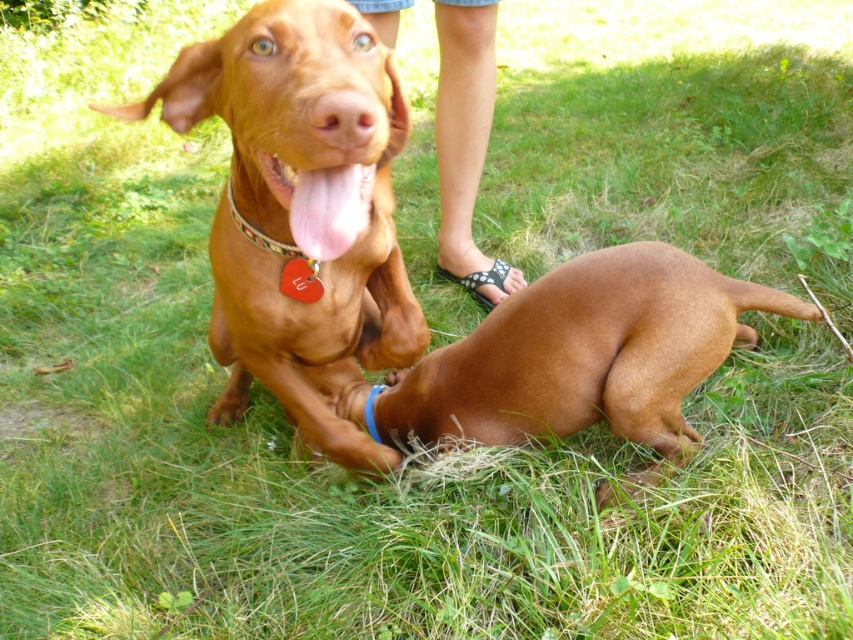
Which of these two, red heart-shaped tag at center or pink glossy tongue at center, stands shorter?

pink glossy tongue at center is shorter.

This screenshot has height=640, width=853. I want to click on red heart-shaped tag at center, so click(x=283, y=253).

Does pink glossy tongue at center come in front of blue rubber band at center?

Yes, pink glossy tongue at center is closer to the viewer.

Between pink glossy tongue at center and blue rubber band at center, which one has more height?

Standing taller between the two is blue rubber band at center.

This screenshot has height=640, width=853. Describe the element at coordinates (276, 177) in the screenshot. I see `pink glossy tongue at center` at that location.

The width and height of the screenshot is (853, 640). I want to click on pink glossy tongue at center, so click(x=276, y=177).

Is smooth tan skin at center wider than pink glossy tongue at center?

Indeed, smooth tan skin at center has a greater width compared to pink glossy tongue at center.

Is point (474, 163) less distant than point (270, 186)?

No, it is behind (270, 186).

Between point (457, 74) and point (281, 189), which one is positioned behind?

Point (457, 74)

At what (x,y) coordinates should I click in order to perform the action: click on smooth tan skin at center. Please return your answer as a coordinate pair (x, y). This screenshot has height=640, width=853. Looking at the image, I should click on click(466, 144).